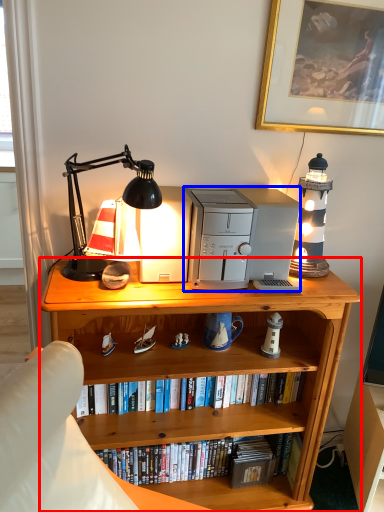
Question: Which point is further to the camera, bookcase (highlighted by a red box) or appliance (highlighted by a blue box)?

Choices:
 (A) bookcase
 (B) appliance

Answer: (B)